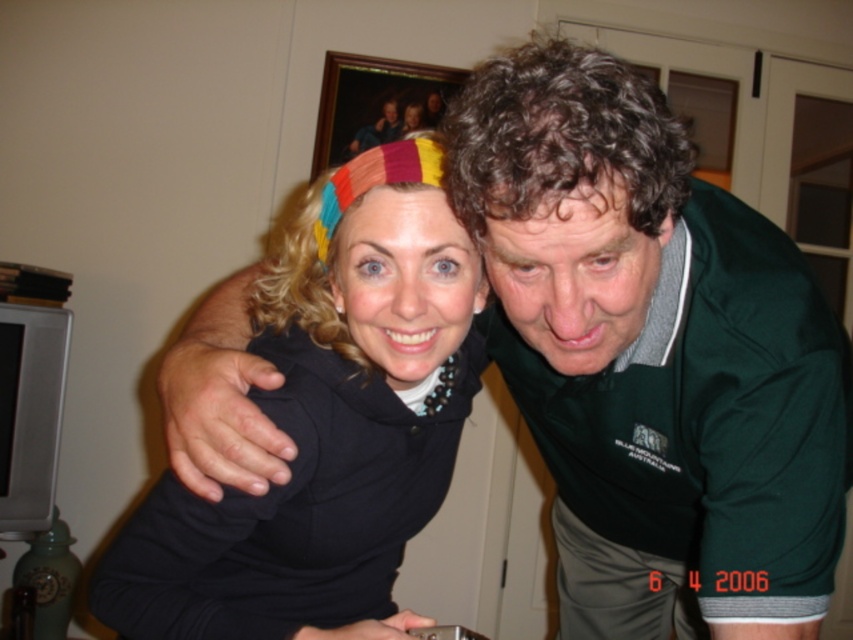
You are a photographer setting up for a portrait session. You notice two headbands in the image. The black matte headband at upper center and the rainbow fabric headband at upper center. Which headband is positioned to the left?

The black matte headband at upper center is to the left of the rainbow fabric headband at upper center.

You are standing in the room where the two people are. You want to place a small sticker exactly at the point with coordinates (x=322, y=436). According to the image, where would this sticker be placed?

The point with coordinates (x=322, y=436) is on the black matte headband at upper center.

You are a photographer adjusting the lighting in this indoor scene. You notice the black matte headband at upper center and the rainbow fabric headband at upper center. Since the two headbands are both at upper center, how far apart are they from each other?

The distance between the black matte headband at upper center and the rainbow fabric headband at upper center is 24.05 centimeters.